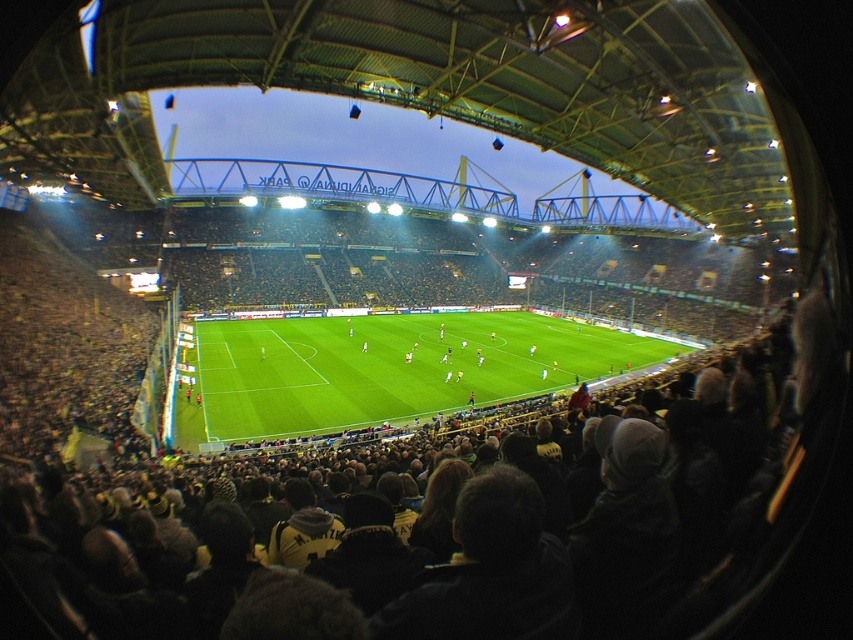
You are a photographer standing at the edge of the soccer field. You want to take a photo of the black fabric crowd at center. Where should you aim your camera to capture them?

You should aim your camera at point (434,531) to capture the black fabric crowd at center.